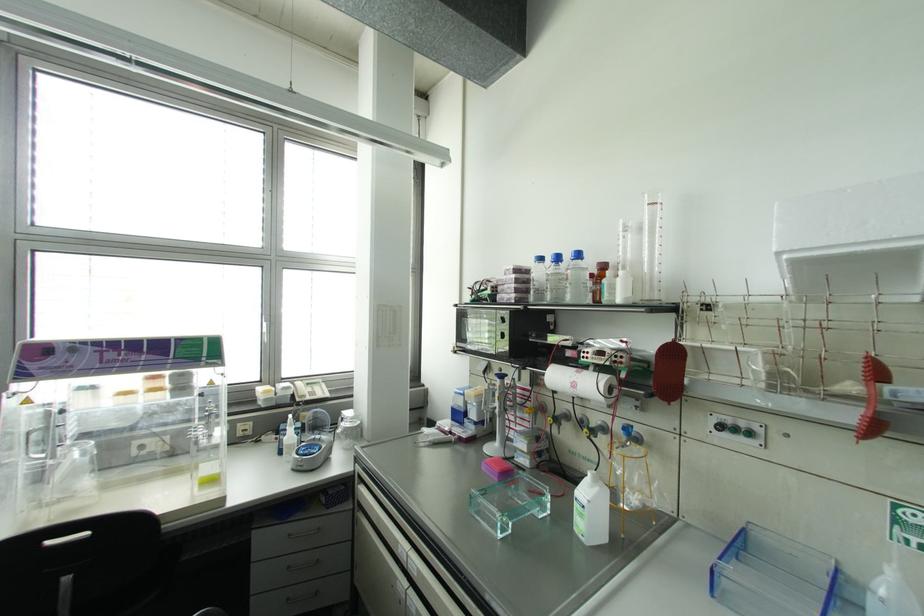
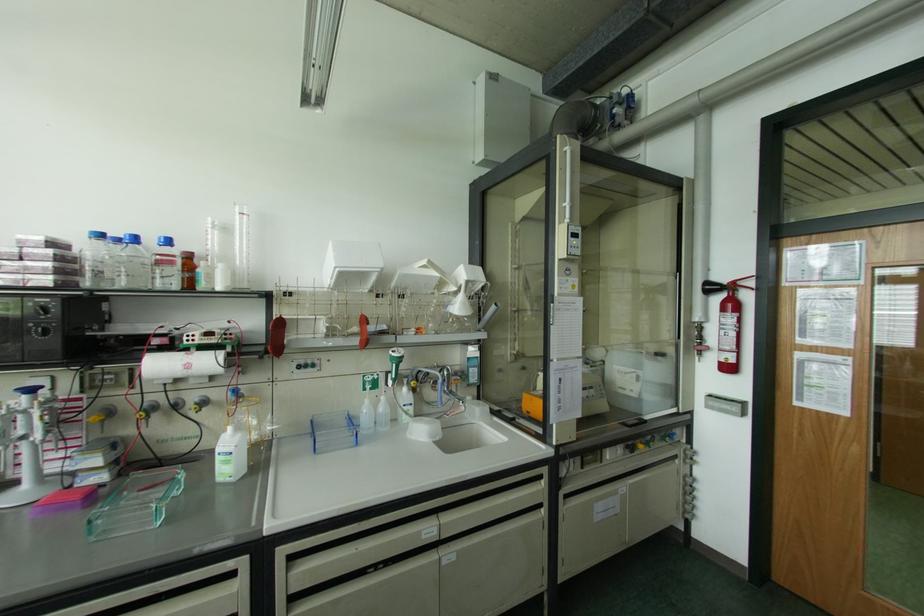
The point at (603, 429) is marked in the first image. Where is the corresponding point in the second image?

(203, 402)